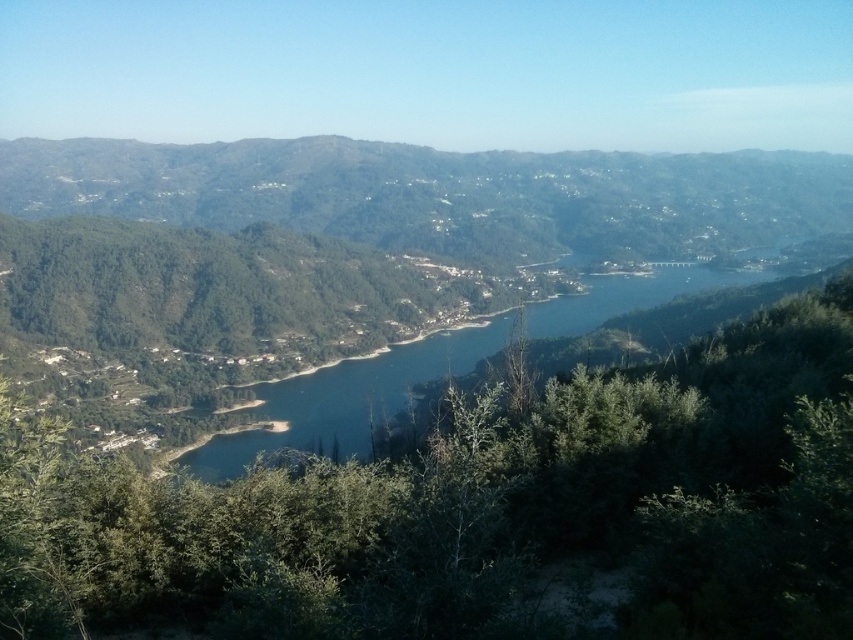
You are standing in the middle of the scene and want to walk towards the green leafy mountain at left. Which direction should you go to avoid the blue water at center?

You should walk towards the green leafy mountain at left, which is closer to you than the blue water at center, so you can reach it without crossing the blue water at center.

You are standing in the serene landscape described. You see a green leafy tree at center and a green leafy mountain at left. Which object is positioned to the left of the other?

The green leafy tree at center is to the left of green leafy mountain at left, meaning the mountain is actually to the right of the tree.

You are standing at the edge of the green leafy tree at center and looking towards the blue water at center. Which object is closer to you?

The green leafy tree at center is closer to you since it is in front of the blue water at center.